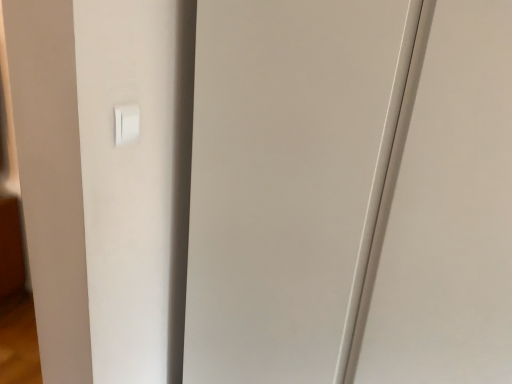
Where is `transparent glass door at center`? transparent glass door at center is located at coordinates (287, 180).

The width and height of the screenshot is (512, 384). What do you see at coordinates (287, 180) in the screenshot?
I see `transparent glass door at center` at bounding box center [287, 180].

Find the location of `white plastic light switch at upper left`. white plastic light switch at upper left is located at coordinates (126, 123).

This screenshot has height=384, width=512. What do you see at coordinates (126, 123) in the screenshot? I see `white plastic light switch at upper left` at bounding box center [126, 123].

The width and height of the screenshot is (512, 384). I want to click on transparent glass door at center, so 287,180.

In the scene shown: Considering the relative positions of transparent glass door at center and white plastic light switch at upper left in the image provided, is transparent glass door at center to the left or to the right of white plastic light switch at upper left?

Clearly, transparent glass door at center is on the right of white plastic light switch at upper left in the image.

Considering the relative positions of transparent glass door at center and white plastic light switch at upper left in the image provided, is transparent glass door at center in front of white plastic light switch at upper left?

Yes, transparent glass door at center is closer to the viewer.

Is point (271, 61) closer to camera compared to point (131, 123)?

No.

From the image's perspective, between transparent glass door at center and white plastic light switch at upper left, who is located below?

From the image's view, transparent glass door at center is below.

From a real-world perspective, between transparent glass door at center and white plastic light switch at upper left, who is vertically higher?

white plastic light switch at upper left, from a real-world perspective.

Does transparent glass door at center have a lesser width compared to white plastic light switch at upper left?

No.

Does transparent glass door at center have a greater height compared to white plastic light switch at upper left?

Correct, transparent glass door at center is much taller as white plastic light switch at upper left.

Does transparent glass door at center have a smaller size compared to white plastic light switch at upper left?

Incorrect, transparent glass door at center is not smaller in size than white plastic light switch at upper left.

Is white plastic light switch at upper left surrounded by transparent glass door at center?

That's incorrect, white plastic light switch at upper left is not inside transparent glass door at center.

Is there a large distance between transparent glass door at center and white plastic light switch at upper left?

That's not correct — transparent glass door at center is a little close to white plastic light switch at upper left.

Is white plastic light switch at upper left at the back of transparent glass door at center?

transparent glass door at center does not have its back to white plastic light switch at upper left.

This screenshot has width=512, height=384. What are the coordinates of `glass door in front of the white plastic light switch at upper left` in the screenshot? It's located at (287, 180).

Considering the relative positions of white plastic light switch at upper left and transparent glass door at center in the image provided, is white plastic light switch at upper left to the right of transparent glass door at center from the viewer's perspective?

In fact, white plastic light switch at upper left is to the left of transparent glass door at center.

Who is more distant, white plastic light switch at upper left or transparent glass door at center?

Positioned behind is white plastic light switch at upper left.

Is point (119, 121) farther from camera compared to point (277, 84)?

No, (119, 121) is closer to viewer.

From the image's perspective, relative to transparent glass door at center, is white plastic light switch at upper left above or below?

white plastic light switch at upper left is above transparent glass door at center.

From a real-world perspective, which object stands above the other?

From a 3D spatial view, white plastic light switch at upper left is above.

Is white plastic light switch at upper left thinner than transparent glass door at center?

Yes, white plastic light switch at upper left is thinner than transparent glass door at center.

In terms of height, does white plastic light switch at upper left look taller or shorter compared to transparent glass door at center?

Considering their sizes, white plastic light switch at upper left has less height than transparent glass door at center.

Is white plastic light switch at upper left bigger than transparent glass door at center?

No.

Is white plastic light switch at upper left inside or outside of transparent glass door at center?

white plastic light switch at upper left lies outside transparent glass door at center.

Is there a large distance between white plastic light switch at upper left and transparent glass door at center?

white plastic light switch at upper left is near transparent glass door at center, not far away.

Is white plastic light switch at upper left facing towards transparent glass door at center?

No, white plastic light switch at upper left does not turn towards transparent glass door at center.

How far apart are white plastic light switch at upper left and transparent glass door at center?

42.92 centimeters.

In order to click on light switch behind the transparent glass door at center in this screenshot , I will do `click(126, 123)`.

Where is `light switch that is on the left side of transparent glass door at center`? The image size is (512, 384). light switch that is on the left side of transparent glass door at center is located at coordinates (126, 123).

Locate an element on the screen. The height and width of the screenshot is (384, 512). light switch above the transparent glass door at center (from a real-world perspective) is located at coordinates (126, 123).